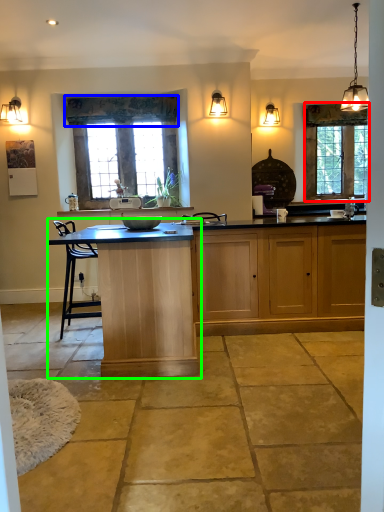
Question: Which object is the closest to the window (highlighted by a red box)? Choose among these: curtain (highlighted by a blue box) or table (highlighted by a green box).

Choices:
 (A) curtain
 (B) table

Answer: (A)